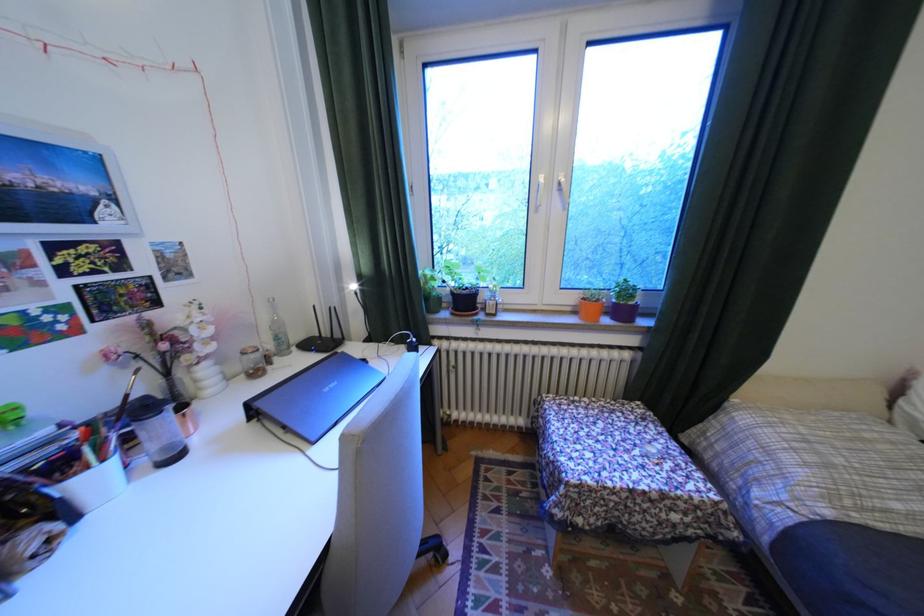
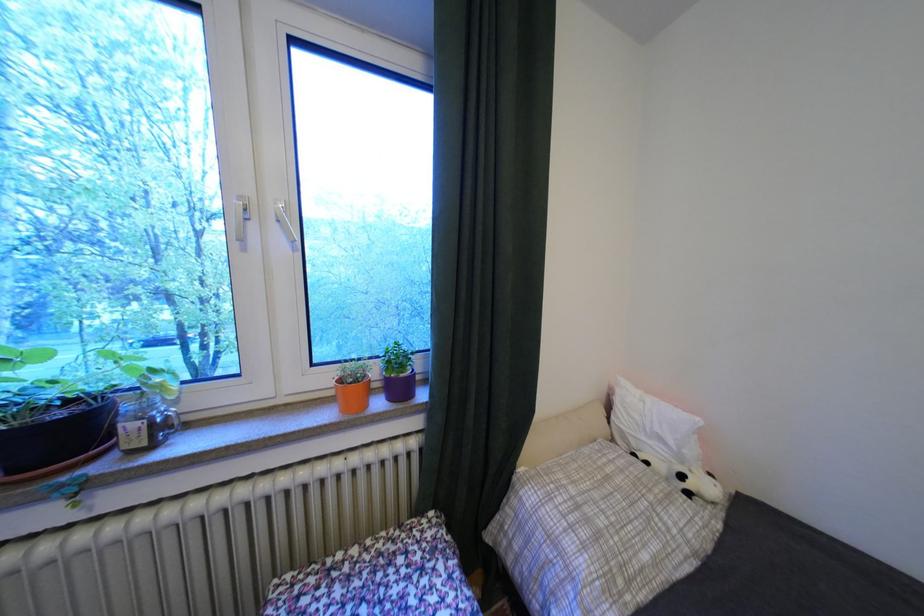
In the second image, find the point that corresponds to (x=580, y=309) in the first image.

(343, 392)